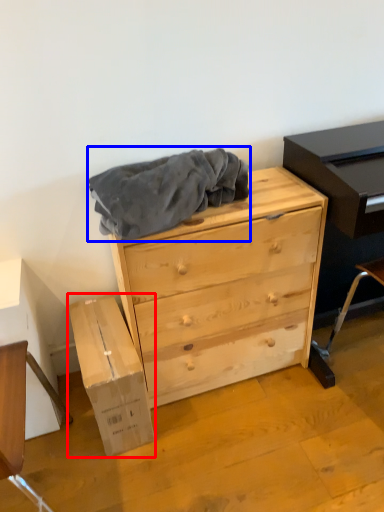
Question: Which point is further to the camera, cardboard box (highlighted by a red box) or clothing (highlighted by a blue box)?

Choices:
 (A) cardboard box
 (B) clothing

Answer: (A)